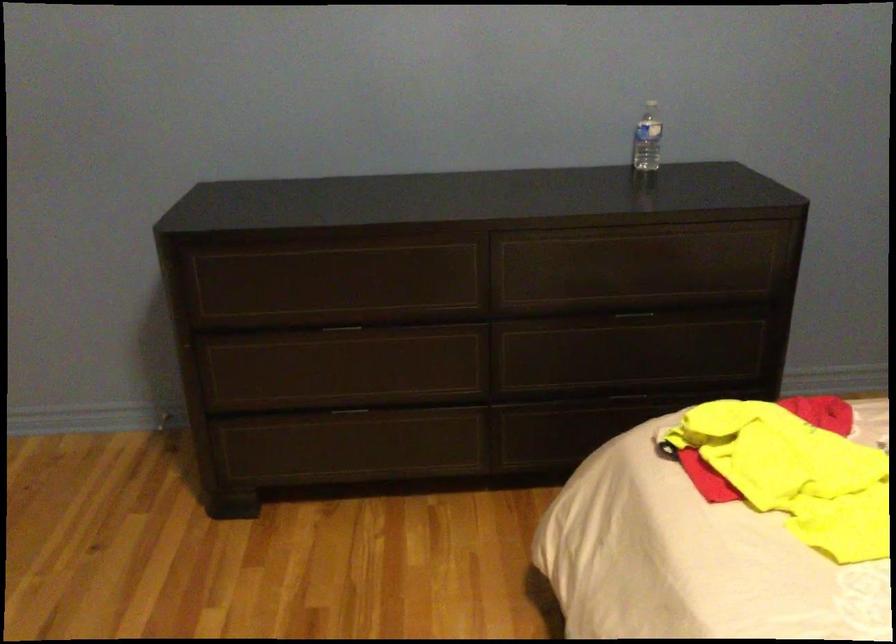
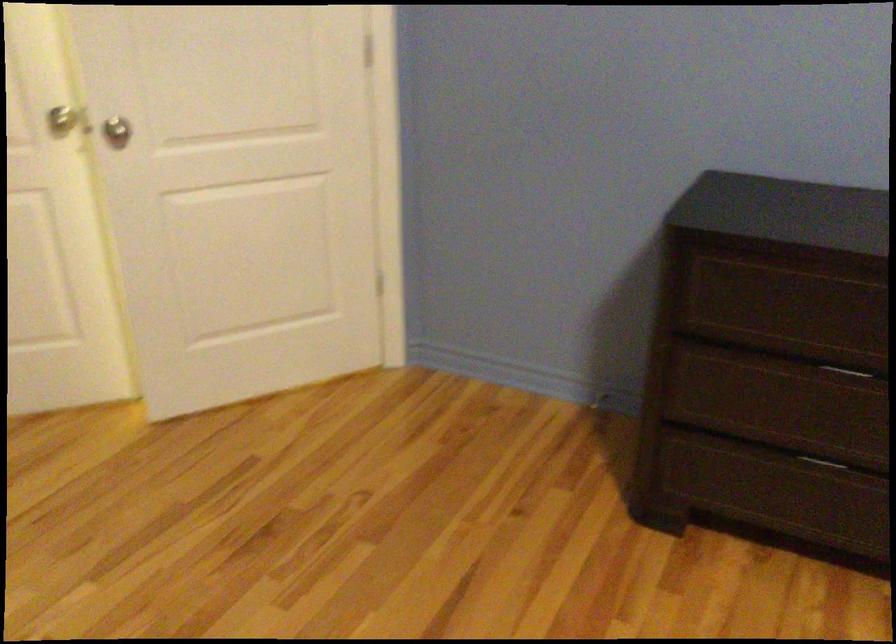
In the second image, find the point that corresponds to pixel 334 330 in the first image.

(850, 371)